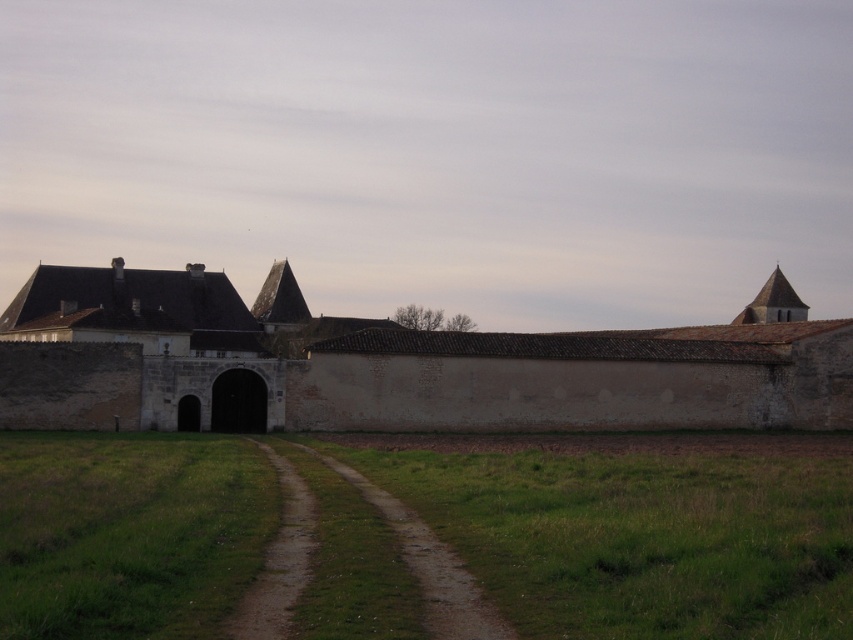
Question: Is brown stone wall at center bigger than brown dirt track at center?

Choices:
 (A) yes
 (B) no

Answer: (A)

Question: Which object is the farthest from the brown dirt track at center?

Choices:
 (A) brown stone wall at center
 (B) green grass at center

Answer: (A)

Question: Is green grass at center wider than brown stone wall at center?

Choices:
 (A) yes
 (B) no

Answer: (B)

Question: Which point is closer to the camera taking this photo?

Choices:
 (A) (287, 580)
 (B) (717, 529)
 (C) (587, 339)

Answer: (A)

Question: Is green grass at center further to camera compared to brown stone wall at center?

Choices:
 (A) no
 (B) yes

Answer: (A)

Question: Among these objects, which one is nearest to the camera?

Choices:
 (A) green grass at center
 (B) brown dirt track at center
 (C) brown stone wall at center

Answer: (A)